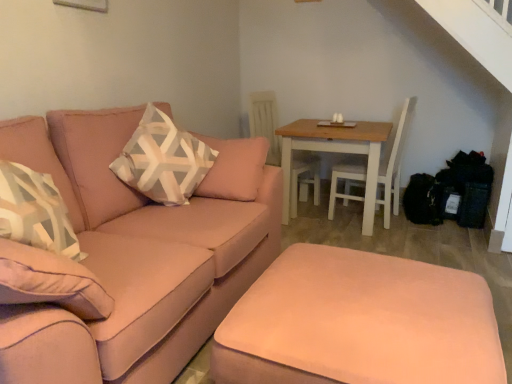
Question: Is patterned fabric pillow at center-left in front of light brown wooden table at center right?

Choices:
 (A) no
 (B) yes

Answer: (B)

Question: From the image's perspective, is patterned fabric pillow at center-left above light brown wooden table at center right?

Choices:
 (A) no
 (B) yes

Answer: (B)

Question: Is patterned fabric pillow at center-left positioned beyond the bounds of light brown wooden table at center right?

Choices:
 (A) no
 (B) yes

Answer: (B)

Question: Is patterned fabric pillow at center-left to the right of light brown wooden table at center right from the viewer's perspective?

Choices:
 (A) yes
 (B) no

Answer: (B)

Question: Considering the relative sizes of patterned fabric pillow at center-left and light brown wooden table at center right in the image provided, is patterned fabric pillow at center-left bigger than light brown wooden table at center right?

Choices:
 (A) no
 (B) yes

Answer: (A)

Question: From a real-world perspective, does patterned fabric pillow at center-left stand above light brown wooden table at center right?

Choices:
 (A) no
 (B) yes

Answer: (B)

Question: Does satin pink couch at left appear on the right side of light brown wooden table at center right?

Choices:
 (A) no
 (B) yes

Answer: (A)

Question: From the image's perspective, would you say satin pink couch at left is positioned over light brown wooden table at center right?

Choices:
 (A) yes
 (B) no

Answer: (B)

Question: Does satin pink couch at left have a lesser width compared to light brown wooden table at center right?

Choices:
 (A) yes
 (B) no

Answer: (B)

Question: Can you confirm if satin pink couch at left is taller than light brown wooden table at center right?

Choices:
 (A) no
 (B) yes

Answer: (B)

Question: Is satin pink couch at left closer to the viewer compared to light brown wooden table at center right?

Choices:
 (A) yes
 (B) no

Answer: (A)

Question: Is satin pink couch at left at the left side of light brown wooden table at center right?

Choices:
 (A) yes
 (B) no

Answer: (A)

Question: Is patterned fabric pillow at center-left far from white wood swivel chair at center?

Choices:
 (A) yes
 (B) no

Answer: (A)